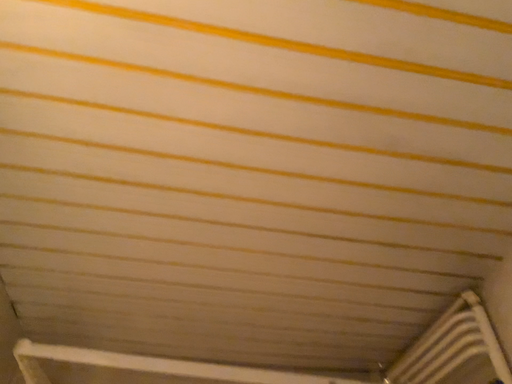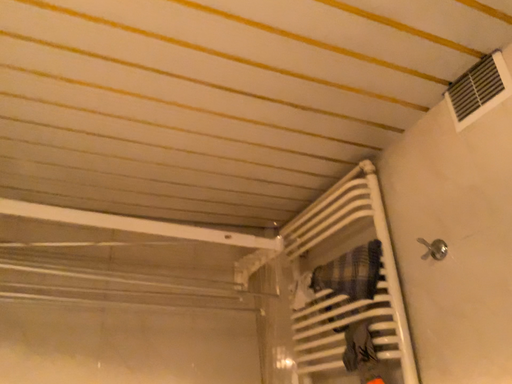
Question: How did the camera likely rotate when shooting the video?

Choices:
 (A) rotated left
 (B) rotated right

Answer: (B)